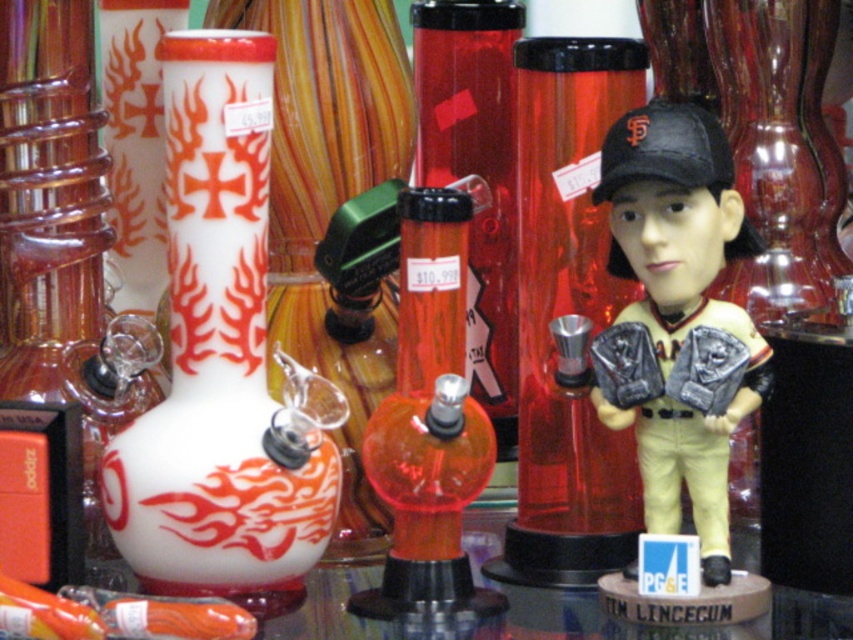
You are a customer at a glass shop and want to buy a bong that can fit in your backpack. Your backpack has a height limit of 15 inches. You see the white glossy bong at left and the translucent orange glass bong at center. Which bong is more likely to fit in your backpack?

The translucent orange glass bong at center is more likely to fit in your backpack since it has a smaller height compared to the white glossy bong at left.

What object is located at the coordinates point (428, 422)?

The translucent orange glass bong at center is located at point (428, 422).